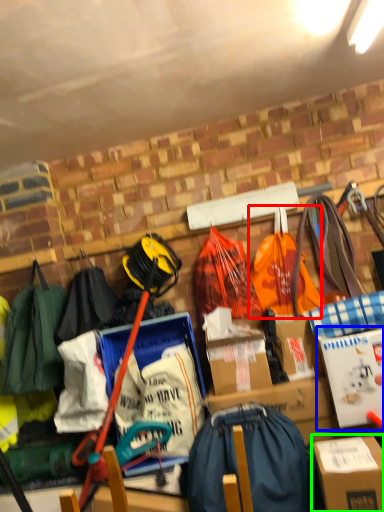
Question: Considering the real-world distances, which object is closest to grocery bag (highlighted by a red box)? cardboard box (highlighted by a blue box) or box (highlighted by a green box).

Choices:
 (A) cardboard box
 (B) box

Answer: (A)